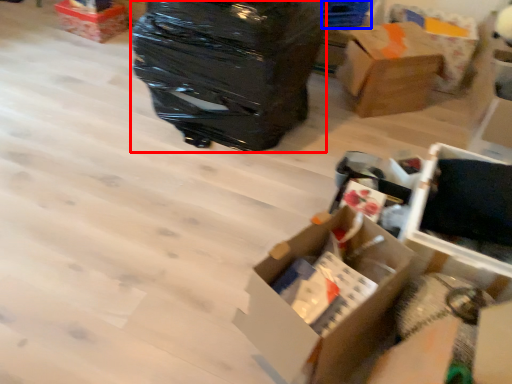
Question: Among these objects, which one is farthest to the camera, garbage (highlighted by a red box) or storage box (highlighted by a blue box)?

Choices:
 (A) garbage
 (B) storage box

Answer: (B)